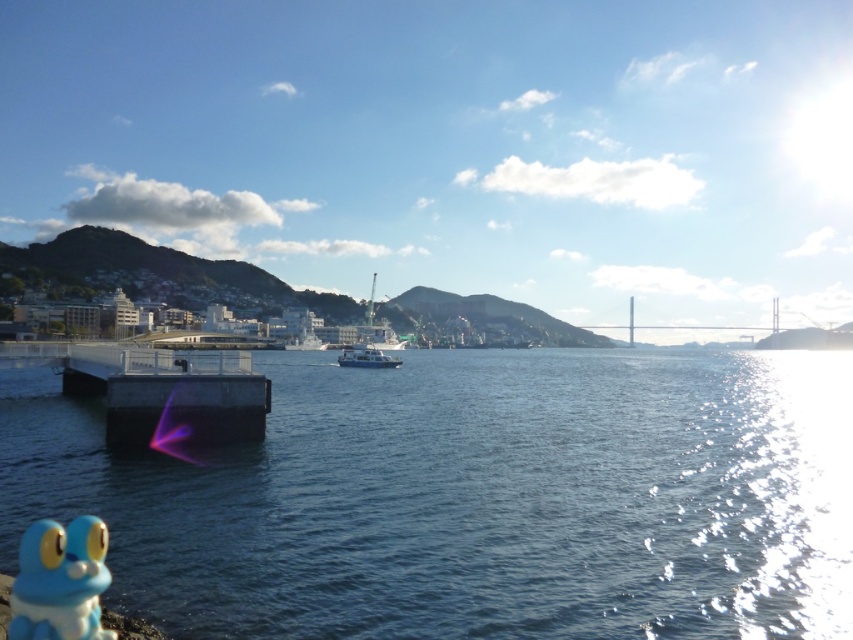
Between blue water at center and metallic gray bridge at center right, which one has more height?

With more height is metallic gray bridge at center right.

Can you confirm if blue water at center is positioned to the left of metallic gray bridge at center right?

Correct, you'll find blue water at center to the left of metallic gray bridge at center right.

Who is more forward, (202, 624) or (729, 330)?

Point (202, 624) is more forward.

This screenshot has height=640, width=853. Identify the location of blue water at center. (473, 499).

Which is more to the right, smooth concrete dock at center-left or white matte boat at center?

white matte boat at center

Does smooth concrete dock at center-left appear on the left side of white matte boat at center?

Yes, smooth concrete dock at center-left is to the left of white matte boat at center.

Does point (189, 385) come farther from viewer compared to point (367, 362)?

That is False.

The width and height of the screenshot is (853, 640). In order to click on smooth concrete dock at center-left in this screenshot , I will do `click(170, 394)`.

Who is shorter, metallic gray bridge at center right or white matte boat at center?

Standing shorter between the two is white matte boat at center.

Image resolution: width=853 pixels, height=640 pixels. What are the coordinates of `metallic gray bridge at center right` in the screenshot? It's located at (683, 324).

Where is `metallic gray bridge at center right`? Image resolution: width=853 pixels, height=640 pixels. metallic gray bridge at center right is located at coordinates (683, 324).